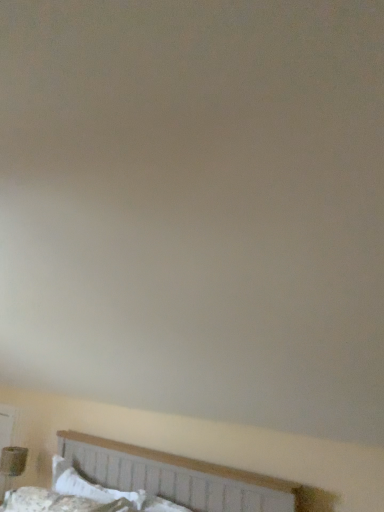
The image size is (384, 512). I want to click on white fabric bed at lower center, so click(175, 476).

Where is `matte brown table lamp at lower left`? This screenshot has height=512, width=384. matte brown table lamp at lower left is located at coordinates (12, 464).

Describe the element at coordinates (12, 464) in the screenshot. I see `matte brown table lamp at lower left` at that location.

Locate an element on the screen. white cotton pillow at lower left is located at coordinates (88, 486).

Based on their sizes in the image, would you say white fabric bed at lower center is bigger or smaller than white cotton pillow at lower left?

Clearly, white fabric bed at lower center is larger in size than white cotton pillow at lower left.

Is white fabric bed at lower center far from white cotton pillow at lower left?

No, white fabric bed at lower center is not far away from white cotton pillow at lower left.

From the image's perspective, which object appears higher, white fabric bed at lower center or white cotton pillow at lower left?

From the image's view, white fabric bed at lower center is above.

Locate an element on the screen. Image resolution: width=384 pixels, height=512 pixels. table lamp lying behind the white fabric bed at lower center is located at coordinates (12, 464).

Does matte brown table lamp at lower left touch white fabric bed at lower center?

matte brown table lamp at lower left is not next to white fabric bed at lower center, and they're not touching.

Can we say matte brown table lamp at lower left lies outside white fabric bed at lower center?

That's correct, matte brown table lamp at lower left is outside of white fabric bed at lower center.

Could you tell me if white cotton pillow at lower left is facing matte brown table lamp at lower left?

No, white cotton pillow at lower left is not oriented towards matte brown table lamp at lower left.

Which object is thinner, white cotton pillow at lower left or matte brown table lamp at lower left?

Thinner between the two is white cotton pillow at lower left.

Is point (73, 481) farther from viewer compared to point (0, 459)?

No, it is not.

Between white cotton pillow at lower left and matte brown table lamp at lower left, which one has smaller size?

Smaller between the two is matte brown table lamp at lower left.

Is the depth of white cotton pillow at lower left less than that of white fabric bed at lower center?

No.

Which of these two, white cotton pillow at lower left or white fabric bed at lower center, is smaller?

Smaller between the two is white cotton pillow at lower left.

Is white cotton pillow at lower left taller or shorter than white fabric bed at lower center?

white cotton pillow at lower left is shorter than white fabric bed at lower center.

From the image's perspective, is matte brown table lamp at lower left located above white cotton pillow at lower left?

Actually, matte brown table lamp at lower left appears below white cotton pillow at lower left in the image.

Locate an element on the screen. The image size is (384, 512). pillow that is in front of the matte brown table lamp at lower left is located at coordinates (88, 486).

Does matte brown table lamp at lower left touch white cotton pillow at lower left?

They are not placed beside each other.

Considering the positions of points (5, 464) and (145, 496), is point (5, 464) closer to camera compared to point (145, 496)?

That is False.

From the image's perspective, which one is positioned higher, white fabric bed at lower center or matte brown table lamp at lower left?

white fabric bed at lower center, from the image's perspective.

Is white fabric bed at lower center to the left of matte brown table lamp at lower left from the viewer's perspective?

In fact, white fabric bed at lower center is to the right of matte brown table lamp at lower left.

Does white fabric bed at lower center have a lesser height compared to matte brown table lamp at lower left?

Correct, white fabric bed at lower center is not as tall as matte brown table lamp at lower left.

How different are the orientations of white fabric bed at lower center and matte brown table lamp at lower left in degrees?

They differ by 1.41 degrees in their facing directions.

Locate an element on the screen. The image size is (384, 512). pillow located on the left of white fabric bed at lower center is located at coordinates (88, 486).

This screenshot has width=384, height=512. I want to click on bed located above the matte brown table lamp at lower left (from the image's perspective), so click(175, 476).

Based on their spatial positions, is white cotton pillow at lower left or matte brown table lamp at lower left closer to white fabric bed at lower center?

white cotton pillow at lower left is closer to white fabric bed at lower center.

When comparing their distances from white cotton pillow at lower left, does white fabric bed at lower center or matte brown table lamp at lower left seem further?

The object further to white cotton pillow at lower left is matte brown table lamp at lower left.

Looking at the image, which one is located closer to matte brown table lamp at lower left, white cotton pillow at lower left or white fabric bed at lower center?

white cotton pillow at lower left is closer to matte brown table lamp at lower left.

Considering their positions, is white fabric bed at lower center positioned closer to matte brown table lamp at lower left than white cotton pillow at lower left?

white cotton pillow at lower left is positioned closer to the anchor matte brown table lamp at lower left.

Which object lies nearer to the anchor point white fabric bed at lower center, matte brown table lamp at lower left or white cotton pillow at lower left?

white cotton pillow at lower left.

From the image, which object appears to be farther from white cotton pillow at lower left, matte brown table lamp at lower left or white fabric bed at lower center?

matte brown table lamp at lower left.

Where is `pillow positioned between white fabric bed at lower center and matte brown table lamp at lower left from near to far`? The image size is (384, 512). pillow positioned between white fabric bed at lower center and matte brown table lamp at lower left from near to far is located at coordinates (88, 486).